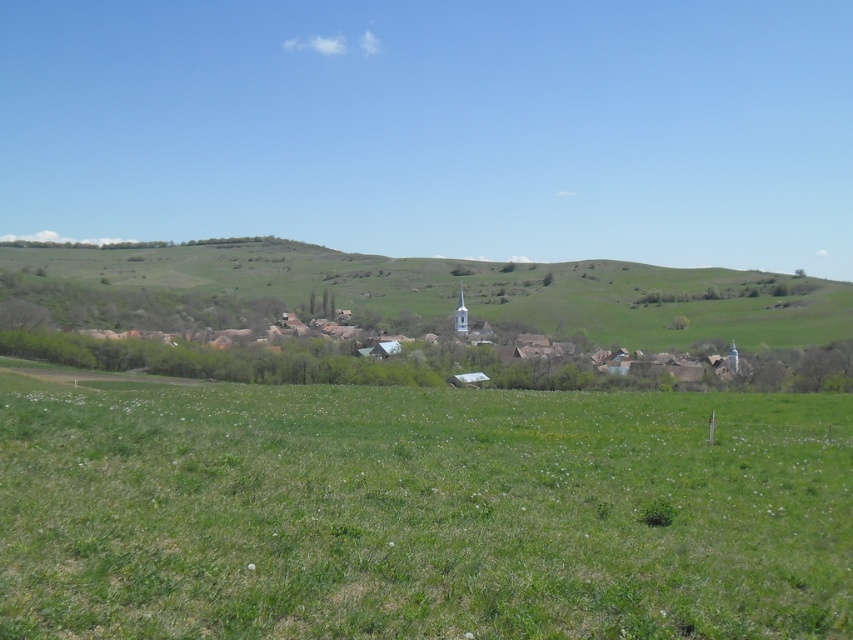
Question: Which of these objects is positioned closest to the green grassy hillside at center?

Choices:
 (A) white wooden houses at center
 (B) green grass pasture at center

Answer: (A)

Question: Can you confirm if green grass pasture at center is smaller than white wooden houses at center?

Choices:
 (A) no
 (B) yes

Answer: (B)

Question: Is green grass pasture at center positioned behind green grassy hillside at center?

Choices:
 (A) yes
 (B) no

Answer: (B)

Question: Which object is farther from the camera taking this photo?

Choices:
 (A) green grass pasture at center
 (B) green grassy hillside at center

Answer: (B)

Question: Which point is closer to the camera?

Choices:
 (A) green grassy hillside at center
 (B) green grass pasture at center
 (C) white wooden houses at center

Answer: (B)

Question: Is green grass pasture at center thinner than white wooden houses at center?

Choices:
 (A) no
 (B) yes

Answer: (B)